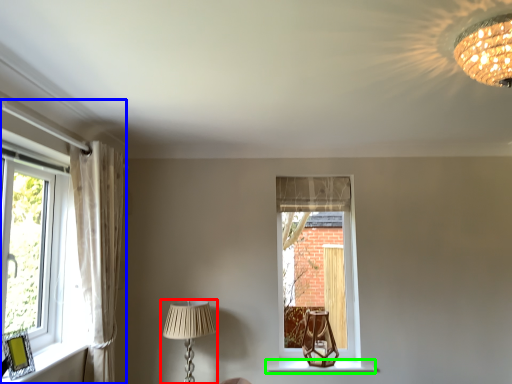
Question: Which is farther away from lamp (highlighted by a red box)? window (highlighted by a blue box) or window sill (highlighted by a green box)?

Choices:
 (A) window
 (B) window sill

Answer: (B)